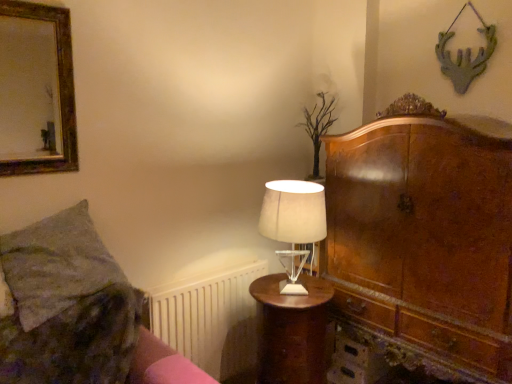
Question: Does green textured pillow at left have a larger size compared to pink fabric bed frame at lower left?

Choices:
 (A) yes
 (B) no

Answer: (A)

Question: Considering the relative sizes of green textured pillow at left and pink fabric bed frame at lower left in the image provided, is green textured pillow at left shorter than pink fabric bed frame at lower left?

Choices:
 (A) no
 (B) yes

Answer: (A)

Question: Is green textured pillow at left not near pink fabric bed frame at lower left?

Choices:
 (A) yes
 (B) no

Answer: (B)

Question: Can you confirm if green textured pillow at left is smaller than pink fabric bed frame at lower left?

Choices:
 (A) yes
 (B) no

Answer: (B)

Question: From a real-world perspective, is green textured pillow at left on top of pink fabric bed frame at lower left?

Choices:
 (A) no
 (B) yes

Answer: (B)

Question: Considering the positions of gold-framed mirror at upper left and white plastic radiator at lower left in the image, is gold-framed mirror at upper left wider or thinner than white plastic radiator at lower left?

Choices:
 (A) thin
 (B) wide

Answer: (A)

Question: Relative to white plastic radiator at lower left, is gold-framed mirror at upper left in front or behind?

Choices:
 (A) behind
 (B) front

Answer: (B)

Question: From their relative heights in the image, would you say gold-framed mirror at upper left is taller or shorter than white plastic radiator at lower left?

Choices:
 (A) tall
 (B) short

Answer: (B)

Question: Considering the positions of gold-framed mirror at upper left and white plastic radiator at lower left in the image, is gold-framed mirror at upper left bigger or smaller than white plastic radiator at lower left?

Choices:
 (A) big
 (B) small

Answer: (B)

Question: Considering the positions of gold-framed mirror at upper left and green textured pillow at left in the image, is gold-framed mirror at upper left wider or thinner than green textured pillow at left?

Choices:
 (A) thin
 (B) wide

Answer: (A)

Question: In terms of height, does gold-framed mirror at upper left look taller or shorter compared to green textured pillow at left?

Choices:
 (A) short
 (B) tall

Answer: (B)

Question: In terms of size, does gold-framed mirror at upper left appear bigger or smaller than green textured pillow at left?

Choices:
 (A) big
 (B) small

Answer: (B)

Question: Relative to green textured pillow at left, is gold-framed mirror at upper left in front or behind?

Choices:
 (A) front
 (B) behind

Answer: (B)

Question: Relative to gold-framed mirror at upper left, is green textured pillow at left in front or behind?

Choices:
 (A) front
 (B) behind

Answer: (A)

Question: From the image's perspective, is green textured pillow at left positioned above or below gold-framed mirror at upper left?

Choices:
 (A) above
 (B) below

Answer: (B)